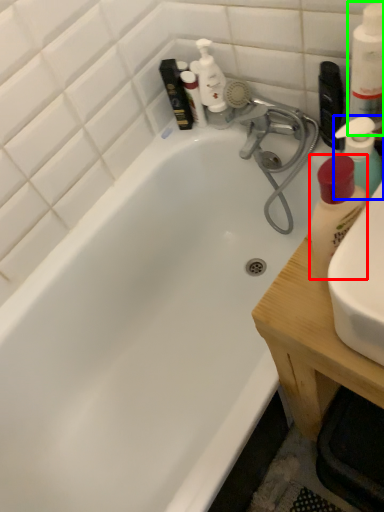
Question: Which is nearer to the cleaning product (highlighted by a red box)? cleaning product (highlighted by a blue box) or cleaning product (highlighted by a green box).

Choices:
 (A) cleaning product
 (B) cleaning product

Answer: (A)